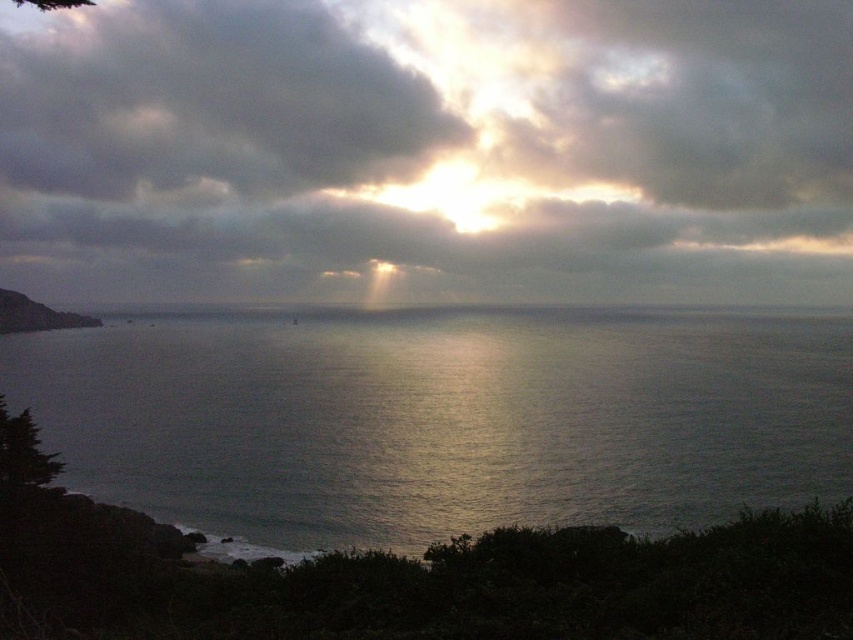
Who is higher up, cloudy sky at upper center or glistening silver water at center?

cloudy sky at upper center is above.

The image size is (853, 640). What do you see at coordinates (428, 148) in the screenshot?
I see `cloudy sky at upper center` at bounding box center [428, 148].

Locate an element on the screen. cloudy sky at upper center is located at coordinates (428, 148).